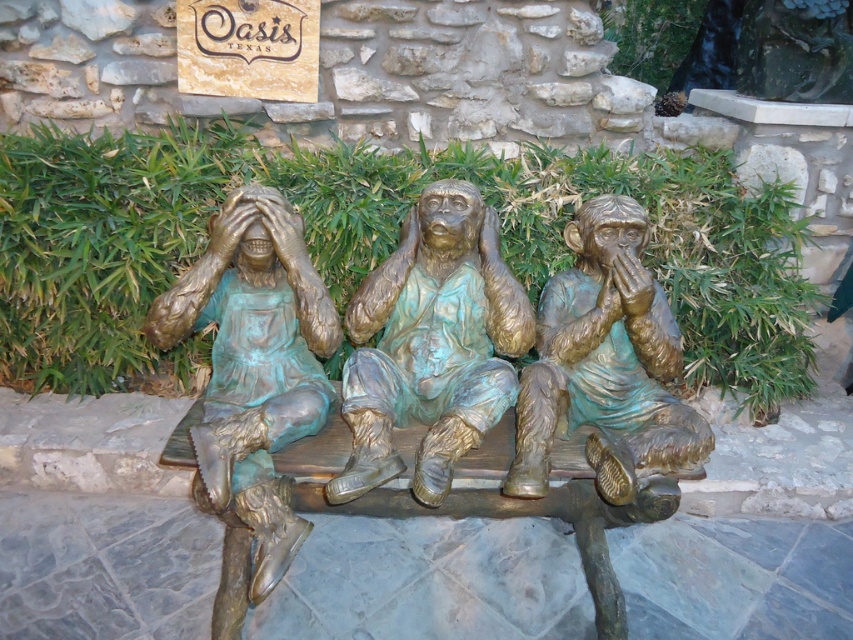
Question: Among these objects, which one is farthest from the camera?

Choices:
 (A) green patina bronze monkey at center
 (B) bronze statue at left
 (C) bronze statue at center

Answer: (A)

Question: Which is farther from the green patina bronze monkey at center?

Choices:
 (A) bronze statue at center
 (B) bronze statue at left

Answer: (B)

Question: Which of the following is the closest to the observer?

Choices:
 (A) bronze statue at left
 (B) bronze statue at center

Answer: (A)

Question: Is bronze statue at center positioned at the back of bronze statue at left?

Choices:
 (A) yes
 (B) no

Answer: (A)

Question: Is bronze statue at left smaller than green patina bronze monkey at center?

Choices:
 (A) no
 (B) yes

Answer: (A)

Question: Does bronze statue at center have a greater width compared to green patina bronze monkey at center?

Choices:
 (A) yes
 (B) no

Answer: (B)